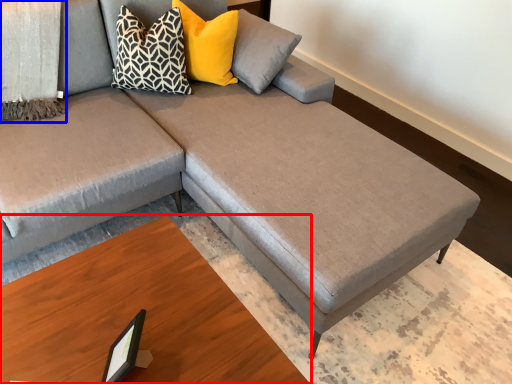
Question: Which point is closer to the camera, table (highlighted by a red box) or blanket (highlighted by a blue box)?

Choices:
 (A) table
 (B) blanket

Answer: (A)